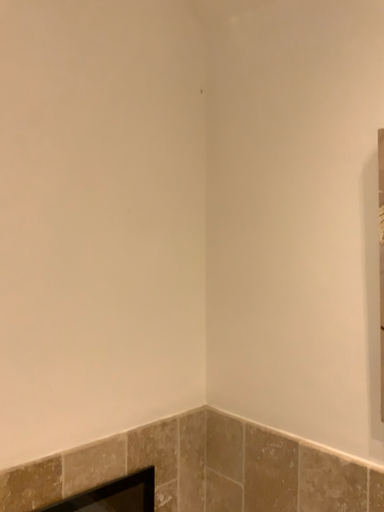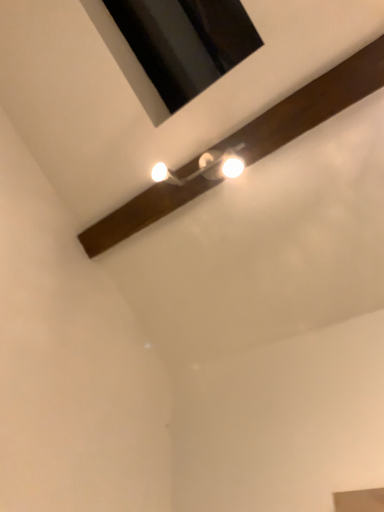
Question: How did the camera likely rotate when shooting the video?

Choices:
 (A) rotated downward
 (B) rotated upward

Answer: (B)